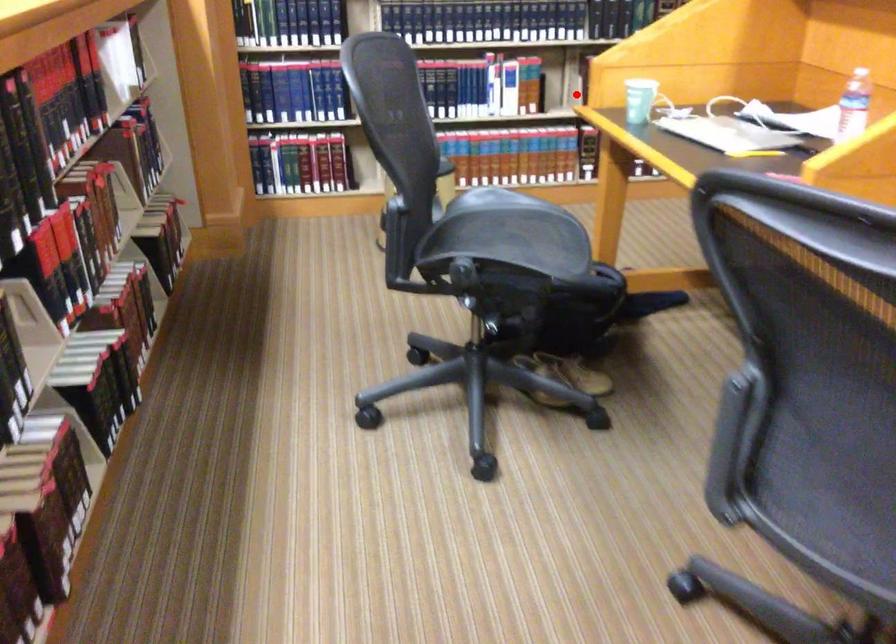
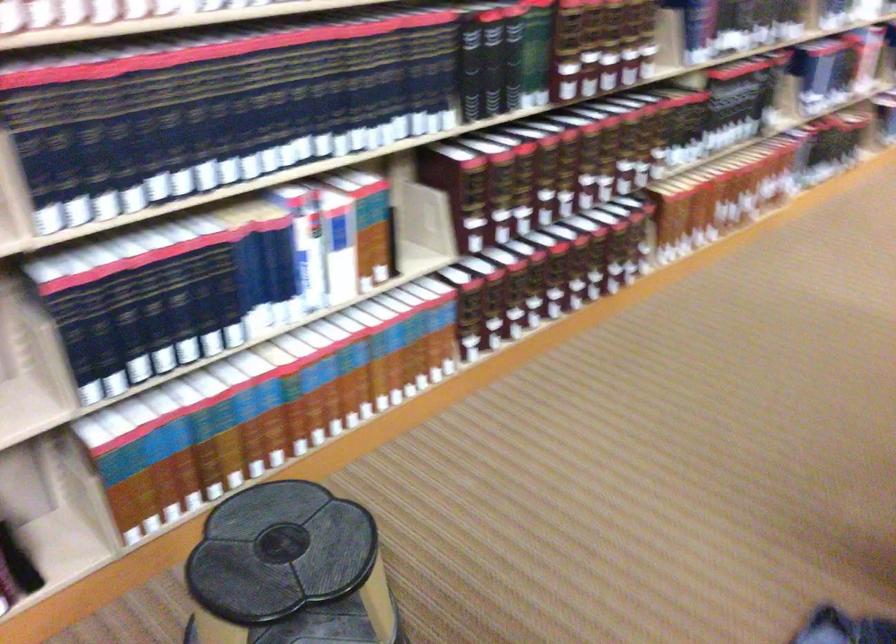
Where in the second image is the point corresponding to the highlighted location from the first image?

(421, 228)